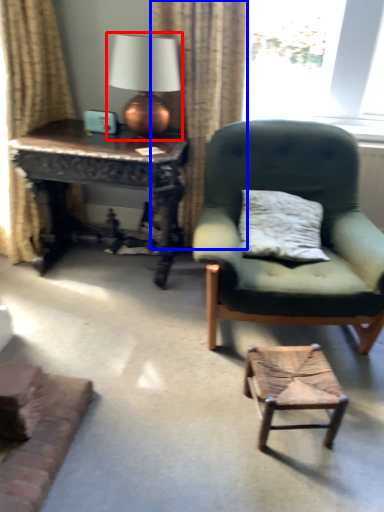
Question: Among these objects, which one is farthest to the camera, table lamp (highlighted by a red box) or curtain (highlighted by a blue box)?

Choices:
 (A) table lamp
 (B) curtain

Answer: (B)